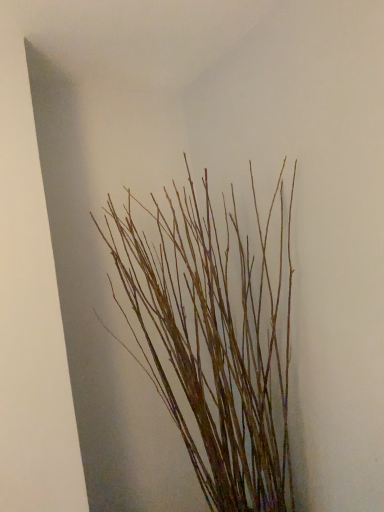
The height and width of the screenshot is (512, 384). What do you see at coordinates (213, 347) in the screenshot?
I see `brown textured sticks at center` at bounding box center [213, 347].

I want to click on brown textured sticks at center, so click(213, 347).

Identify the location of brown textured sticks at center. (213, 347).